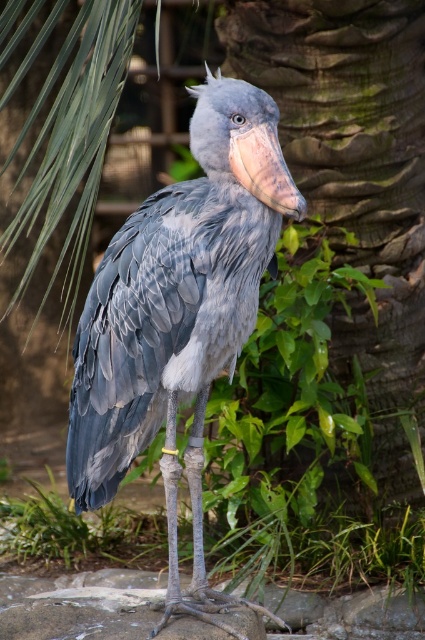
Can you confirm if gray matte bird at center is positioned above rough bark tree trunk at center?

No.

Can you confirm if gray matte bird at center is wider than rough bark tree trunk at center?

No, gray matte bird at center is not wider than rough bark tree trunk at center.

Between point (190, 371) and point (314, 198), which one is positioned in front?

Point (190, 371) is more forward.

Image resolution: width=425 pixels, height=640 pixels. I want to click on gray matte bird at center, so click(x=178, y=316).